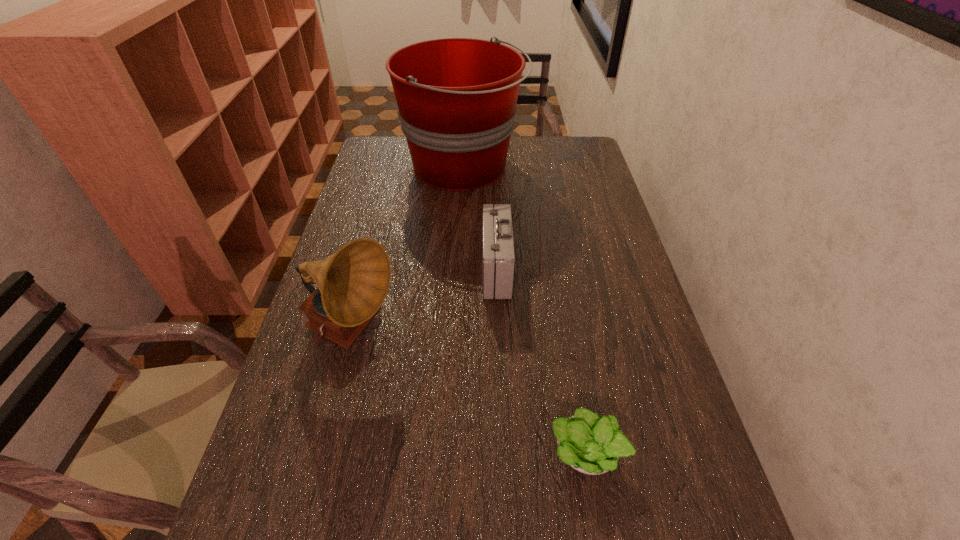
Locate an element on the screen. bucket is located at coordinates (456, 97).

You are a GUI agent. You are given a task and a screenshot of the screen. Output one action in this format:
    pyautogui.click(x=<x>, y=<y>)
    Task: Click on the farthest object
    
    Given the screenshot: What is the action you would take?
    pyautogui.click(x=456, y=97)

The height and width of the screenshot is (540, 960). Identify the location of the third shortest object. (352, 284).

Identify the location of the first-aid kit. (498, 256).

Locate an element on the screen. the shortest object is located at coordinates click(590, 444).

Where is `lettuce`? This screenshot has height=540, width=960. lettuce is located at coordinates (590, 444).

Image resolution: width=960 pixels, height=540 pixels. What are the coordinates of `free location located on the front of the bucket` in the screenshot? It's located at (460, 215).

Locate an element on the screen. The image size is (960, 540). vacant space situated 0.350m on the horn of the phonograph record is located at coordinates (x=540, y=334).

Image resolution: width=960 pixels, height=540 pixels. In order to click on blank space located on the front-facing side of the second shortest object in this screenshot , I will do `click(406, 269)`.

At what (x,y) coordinates should I click in order to perform the action: click on free spot located on the front-facing side of the second shortest object. Please return your answer as a coordinate pair (x, y). The width and height of the screenshot is (960, 540). Looking at the image, I should click on (438, 269).